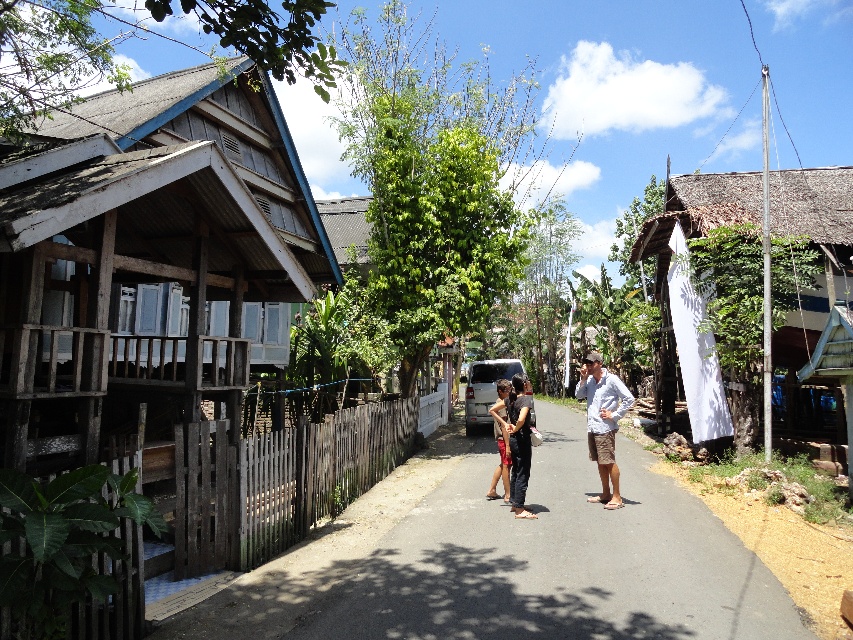
Question: Which point is closer to the camera taking this photo?

Choices:
 (A) (517, 436)
 (B) (505, 456)

Answer: (A)

Question: Is wooden hut at left thinner than dark gray pants at center?

Choices:
 (A) no
 (B) yes

Answer: (A)

Question: Which point is farther to the camera?

Choices:
 (A) light blue shirt at center
 (B) dark gray pants at center
 (C) matte black shorts at center
 (D) wooden fence at lower left

Answer: (C)

Question: Does dark gray pants at center come behind matte black shorts at center?

Choices:
 (A) yes
 (B) no

Answer: (B)

Question: Does light blue shirt at center come behind matte black shorts at center?

Choices:
 (A) yes
 (B) no

Answer: (B)

Question: Estimate the real-world distances between objects in this image. Which object is closer to the wooden fence at lower left?

Choices:
 (A) dark gray pants at center
 (B) matte black shorts at center

Answer: (A)